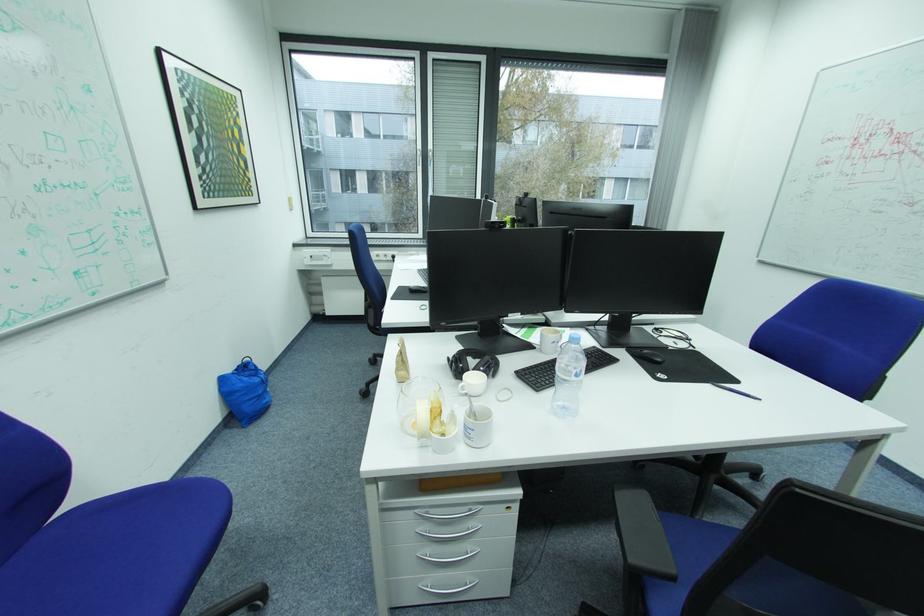
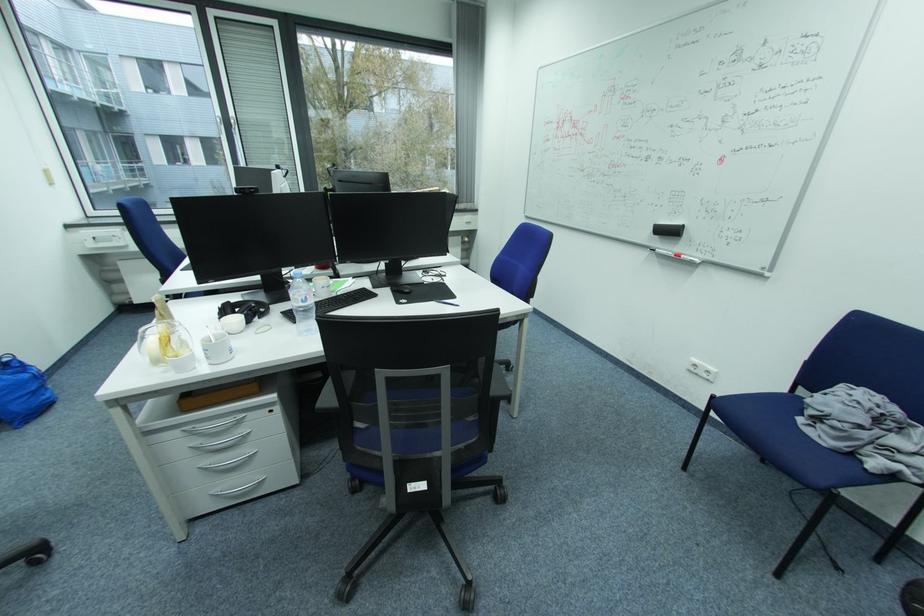
The point at (475, 428) is marked in the first image. Where is the corresponding point in the second image?

(213, 351)